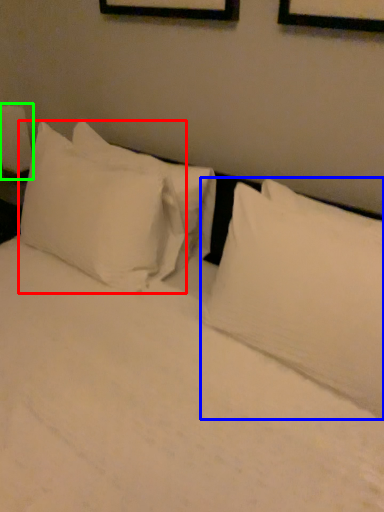
Question: Estimate the real-world distances between objects in this image. Which object is farther from pillow (highlighted by a red box), pillow (highlighted by a blue box) or bedside lamp (highlighted by a green box)?

Choices:
 (A) pillow
 (B) bedside lamp

Answer: (B)